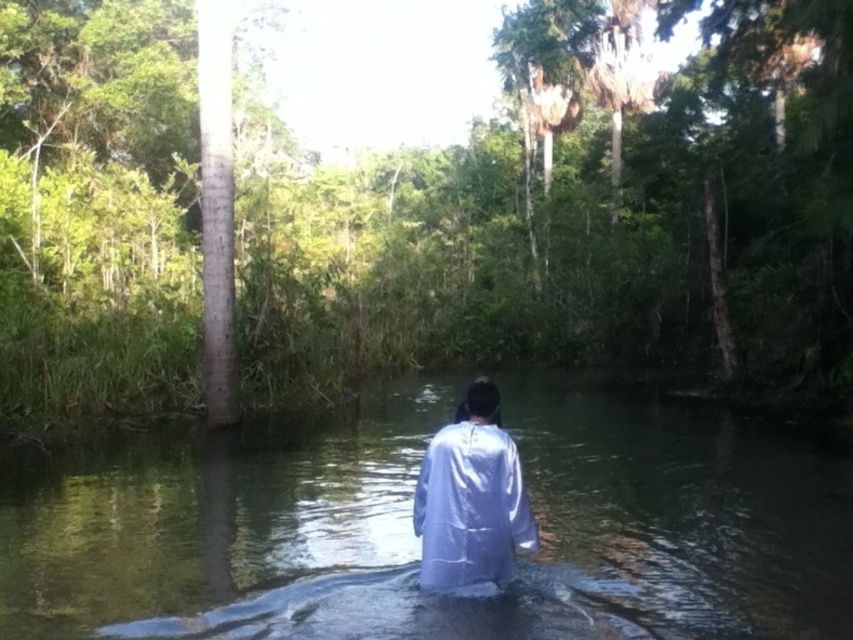
You are standing on the bank of the river shown in the scene. You want to cross the river to the opposite side. There is a point marked at coordinates (418, 540) which is clear water at center. Can you safely step onto this point?

The point at coordinates (418, 540) corresponds to clear water at center, which suggests it might be a safer area to step onto compared to the murky parts. However, since the water is still waist deep and the bottom conditions are unclear, there is some risk involved. Proceed with caution.

You are standing on the bank of the river and want to cross to the other side. The clear water at center is the deepest part of the river. Which direction should you head to avoid the deepest part?

The clear water at center is located at point (418, 540), so to avoid the deepest part, you should head in the opposite direction of that point.